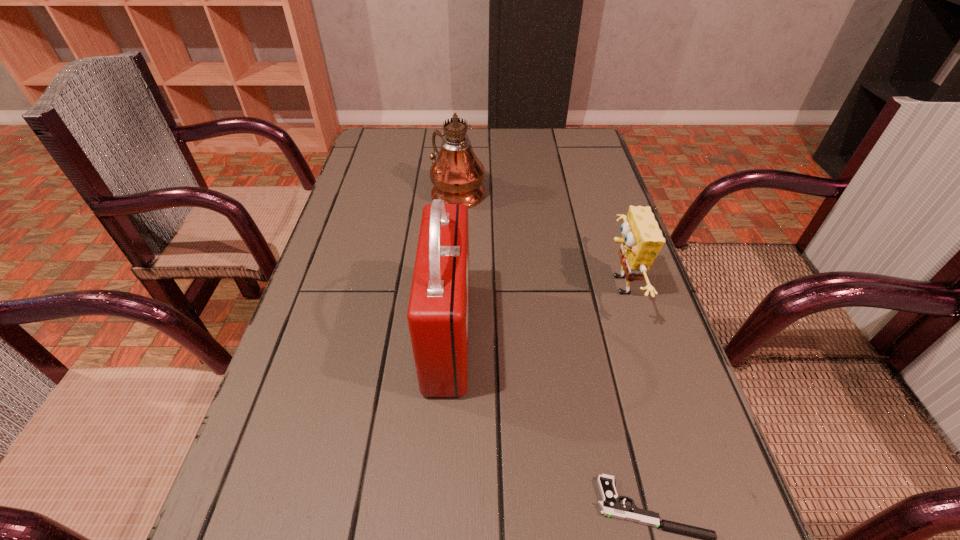
The image size is (960, 540). In the image, there is a desktop. In order to click on vacant space at the far edge in this screenshot , I will do pyautogui.click(x=501, y=132).

Locate an element on the screen. vacant area at the left edge is located at coordinates (350, 242).

The width and height of the screenshot is (960, 540). Find the location of `free region at the right edge of the desktop`. free region at the right edge of the desktop is located at coordinates (656, 310).

The width and height of the screenshot is (960, 540). I want to click on blank space at the far left corner, so click(409, 164).

You are a GUI agent. You are given a task and a screenshot of the screen. Output one action in this format:
    pyautogui.click(x=<x>, y=<y>)
    Task: Click on the empty location between the farthest object and the sponge
    The width and height of the screenshot is (960, 540).
    Given the screenshot: What is the action you would take?
    [538, 239]

Where is `free area in between the first-aid kit and the second shortest object`? The image size is (960, 540). free area in between the first-aid kit and the second shortest object is located at coordinates (533, 312).

The image size is (960, 540). Find the location of `object that stands as the second closest to the farthest object`. object that stands as the second closest to the farthest object is located at coordinates (642, 240).

Select which object is the closest to the second tallest object. Please provide its 2D coordinates. Your answer should be formatted as a tuple, i.e. [(x, y)], where the tuple contains the x and y coordinates of a point satisfying the conditions above.

[(610, 505)]